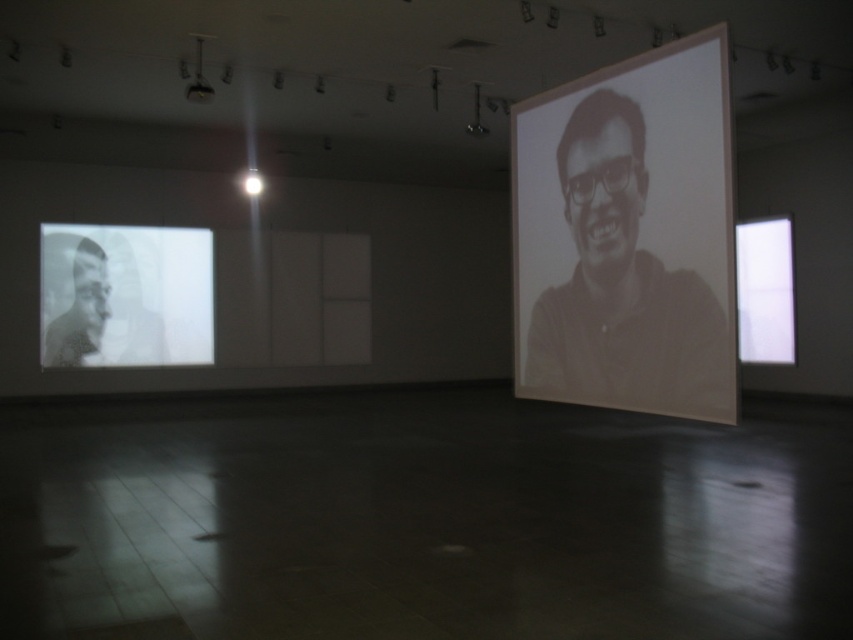
Is white matte projection screen at left below black matte portrait at left?

Actually, white matte projection screen at left is above black matte portrait at left.

Does white matte projection screen at left appear on the right side of black matte portrait at left?

Correct, you'll find white matte projection screen at left to the right of black matte portrait at left.

I want to click on white matte projection screen at left, so click(125, 296).

This screenshot has height=640, width=853. What do you see at coordinates (622, 284) in the screenshot? I see `gray matte portrait at center` at bounding box center [622, 284].

Consider the image. Does gray matte portrait at center appear over metallic projector at upper center?

No.

Does point (614, 317) come farther from viewer compared to point (200, 100)?

No.

The width and height of the screenshot is (853, 640). Identify the location of gray matte portrait at center. (622, 284).

Can you confirm if white glossy projection screen at right is positioned above black matte portrait at left?

Indeed, white glossy projection screen at right is positioned over black matte portrait at left.

Can you confirm if white glossy projection screen at right is thinner than black matte portrait at left?

Correct, white glossy projection screen at right's width is less than black matte portrait at left's.

The height and width of the screenshot is (640, 853). What do you see at coordinates (764, 291) in the screenshot?
I see `white glossy projection screen at right` at bounding box center [764, 291].

Locate an element on the screen. white glossy projection screen at right is located at coordinates (764, 291).